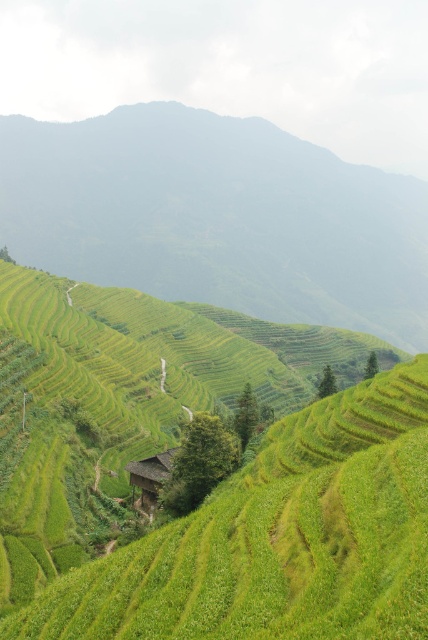
Question: Is green grassy hillside at center further to the viewer compared to brown wooden hut at center?

Choices:
 (A) yes
 (B) no

Answer: (A)

Question: Does green grassy hillside at center have a greater width compared to brown wooden hut at center?

Choices:
 (A) no
 (B) yes

Answer: (B)

Question: Which of the following is the closest to the observer?

Choices:
 (A) (400, 336)
 (B) (145, 496)

Answer: (B)

Question: Where is green grassy hillside at center located in relation to brown wooden hut at center in the image?

Choices:
 (A) below
 (B) above

Answer: (B)